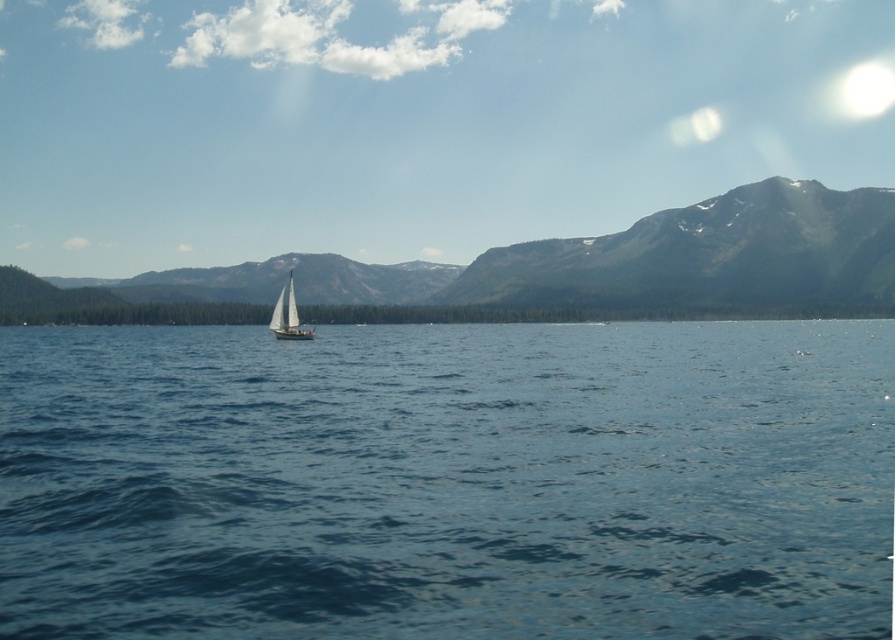
Question: Does blue smooth water at center appear over green textured mountain at center?

Choices:
 (A) no
 (B) yes

Answer: (A)

Question: Can you confirm if blue smooth water at center is smaller than white matte sailboat at center?

Choices:
 (A) yes
 (B) no

Answer: (B)

Question: Which point is closer to the camera taking this photo?

Choices:
 (A) (731, 364)
 (B) (746, 253)

Answer: (A)

Question: Which point is farther to the camera?

Choices:
 (A) green textured mountain at center
 (B) white matte sailboat at center
 (C) blue smooth water at center

Answer: (A)

Question: Which point is farther to the camera?

Choices:
 (A) green textured mountain at center
 (B) blue smooth water at center

Answer: (A)

Question: In this image, where is blue smooth water at center located relative to white matte sailboat at center?

Choices:
 (A) below
 (B) above

Answer: (A)